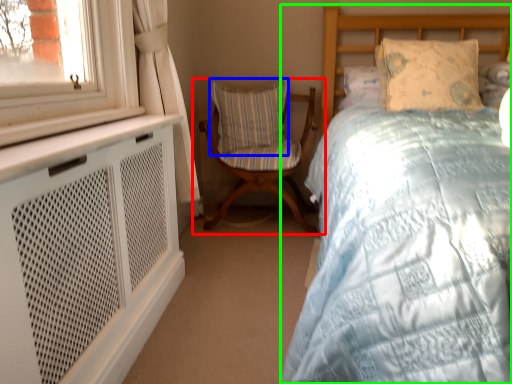
Question: Which object is the farthest from chair (highlighted by a red box)? Choose among these: pillow (highlighted by a blue box) or bed (highlighted by a green box).

Choices:
 (A) pillow
 (B) bed

Answer: (B)